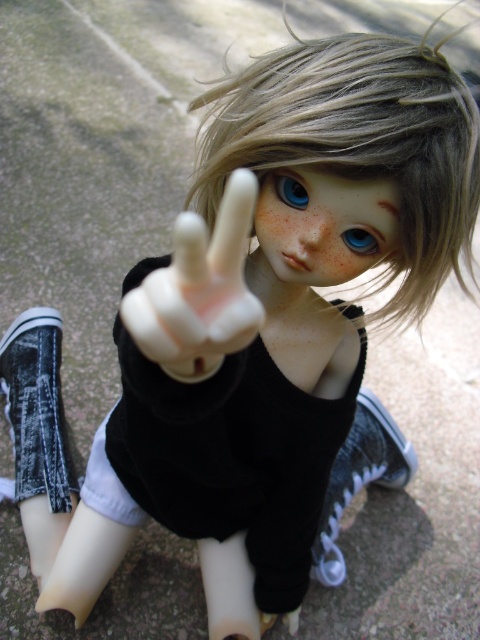
Question: Can you confirm if black matte dress at center is thinner than white matte hand at center?

Choices:
 (A) yes
 (B) no

Answer: (B)

Question: Among these objects, which one is farthest from the camera?

Choices:
 (A) white matte hand at center
 (B) blue glossy eye at upper center

Answer: (B)

Question: Which object is the closest to the white matte hand at center?

Choices:
 (A) blondehair at center
 (B) blue glossy eye at upper center

Answer: (A)

Question: Which object is the farthest from the blue glossy eye at center?

Choices:
 (A) blondehair at center
 (B) black matte dress at center
 (C) white matte hand at center
 (D) blue glossy eye at upper center

Answer: (B)

Question: Is black matte dress at center smaller than blue glossy eye at center?

Choices:
 (A) yes
 (B) no

Answer: (B)

Question: Considering the relative positions of black matte dress at center and blue glossy eye at upper center in the image provided, where is black matte dress at center located with respect to blue glossy eye at upper center?

Choices:
 (A) above
 (B) below

Answer: (B)